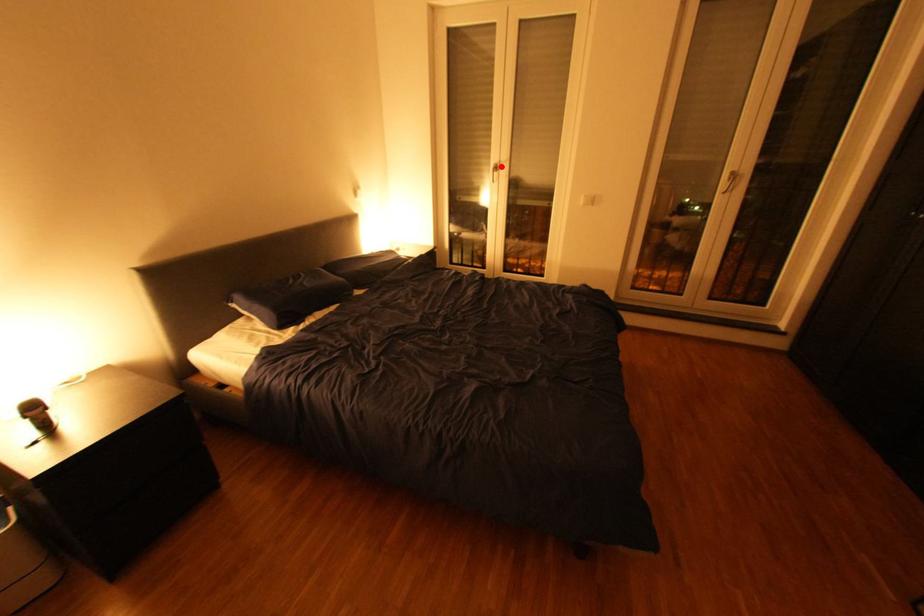
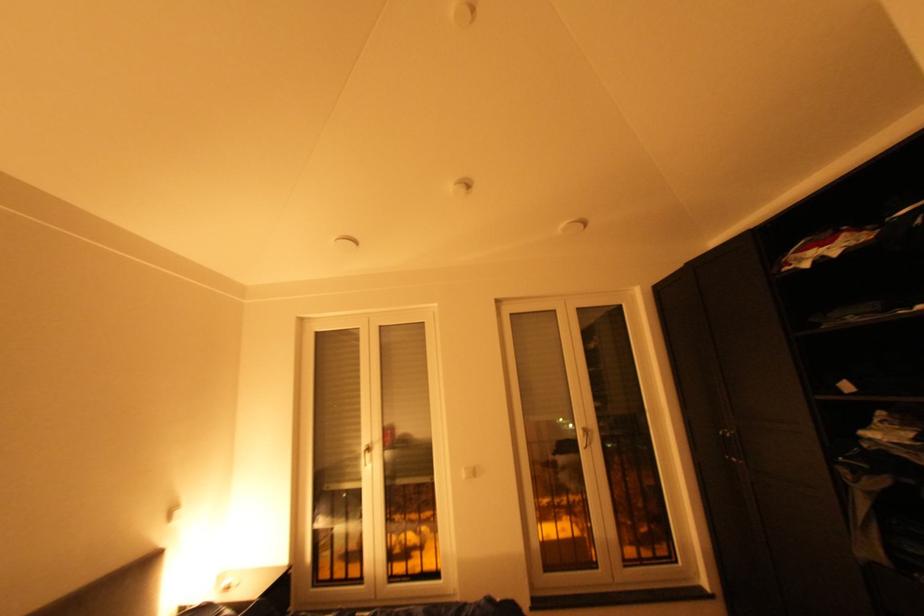
Where in the second image is the point corresponding to the highlighted location from the first image?

(372, 448)